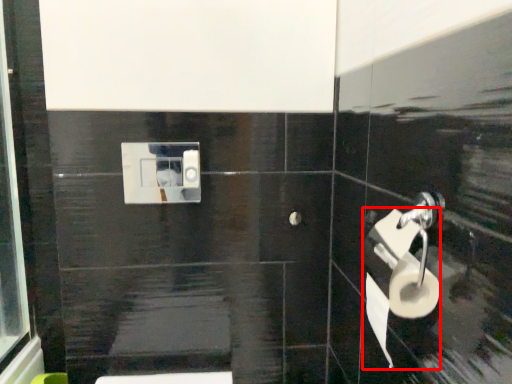
Question: From the image's perspective, where is toilet paper (annotated by the red box) located in relation to toilet paper in the image?

Choices:
 (A) below
 (B) above

Answer: (A)